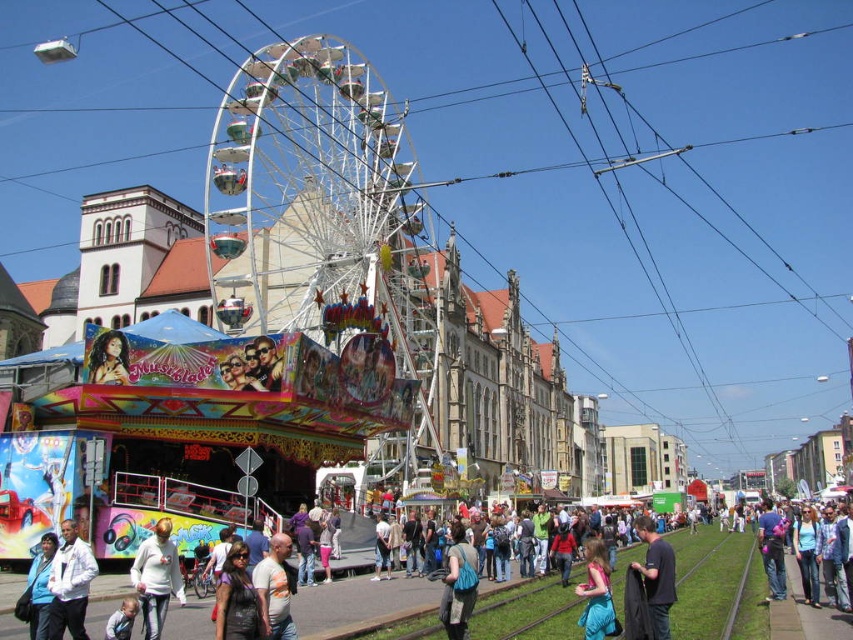
Question: Considering the real-world distances, which object is closest to the dark blue jeans at lower right?

Choices:
 (A) white cotton sweater at center
 (B) blue satin dress at lower center

Answer: (B)

Question: Is white matte jacket at lower left to the left of shiny black hair at center from the viewer's perspective?

Choices:
 (A) yes
 (B) no

Answer: (B)

Question: Which object appears farthest from the camera in this image?

Choices:
 (A) blue fabric bag at center
 (B) white cotton shirt at center
 (C) shiny black hair at center

Answer: (C)

Question: Does white cotton shirt at center appear on the right side of blue satin dress at lower center?

Choices:
 (A) no
 (B) yes

Answer: (B)

Question: Which of the following is the closest to the observer?

Choices:
 (A) (152, 605)
 (B) (402, 586)

Answer: (A)

Question: Can you confirm if light blue shirt at lower center is positioned below dark blue jeans at lower right?

Choices:
 (A) no
 (B) yes

Answer: (A)